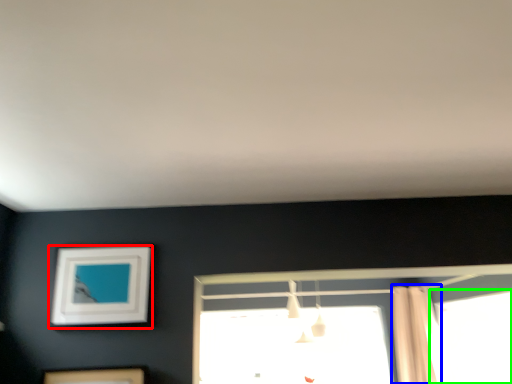
Question: Considering the real-world distances, which object is closest to picture frame (highlighted by a red box)? shower curtain (highlighted by a blue box) or window (highlighted by a green box).

Choices:
 (A) shower curtain
 (B) window

Answer: (A)